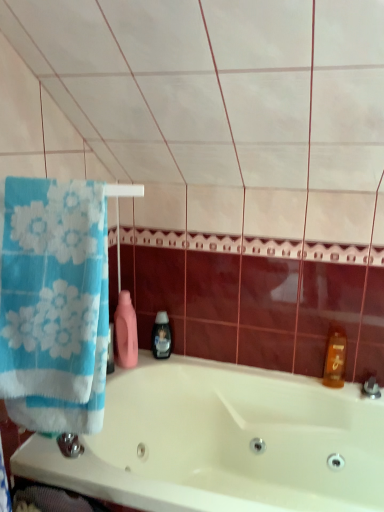
This screenshot has width=384, height=512. Identify the location of vacant position to the left of translucent amber bottle at right. (294, 379).